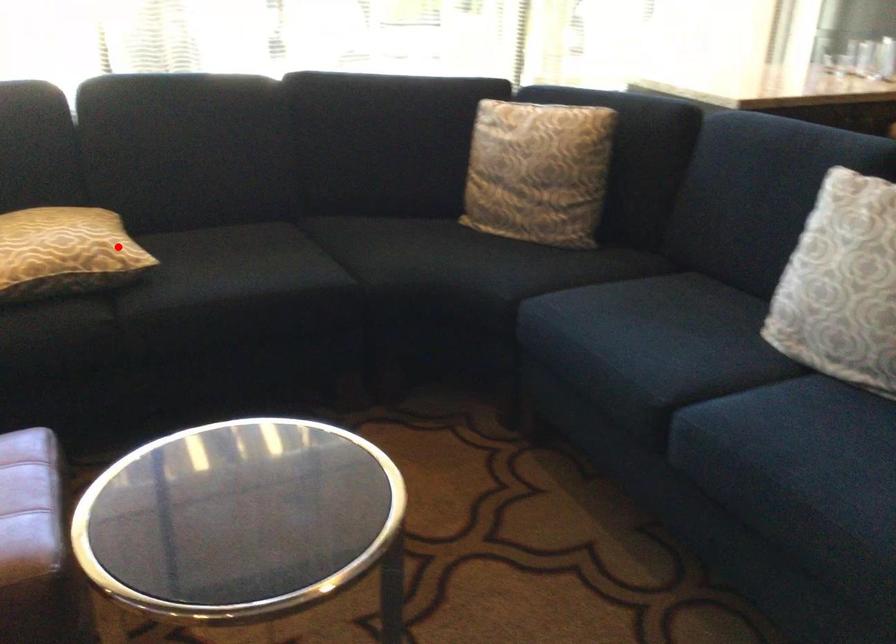
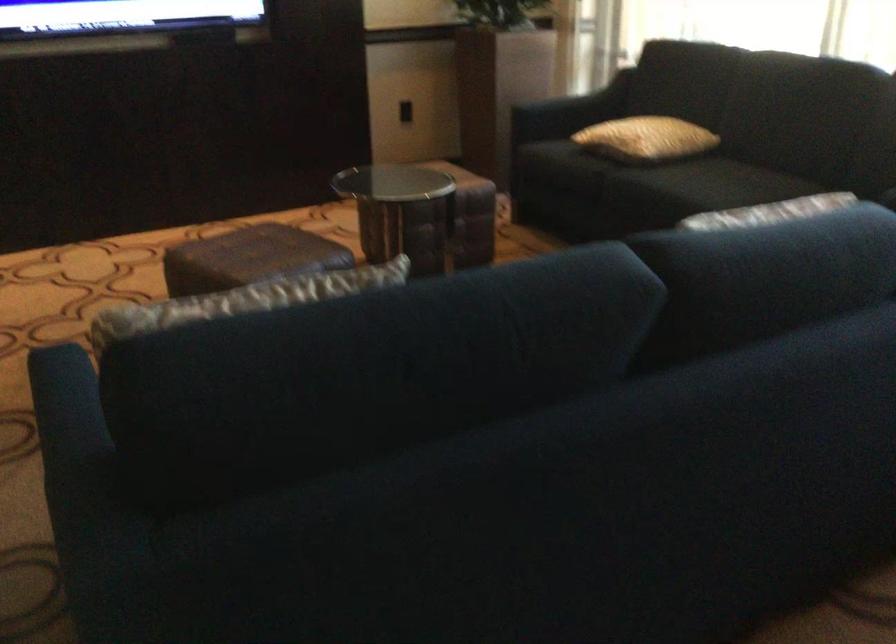
Question: I am providing you with two images of the same scene from different viewpoints. In image1, a red point is highlighted. Considering the same 3D point in image2, which of the following is correct?

Choices:
 (A) It is closer
 (B) It is farther

Answer: (B)